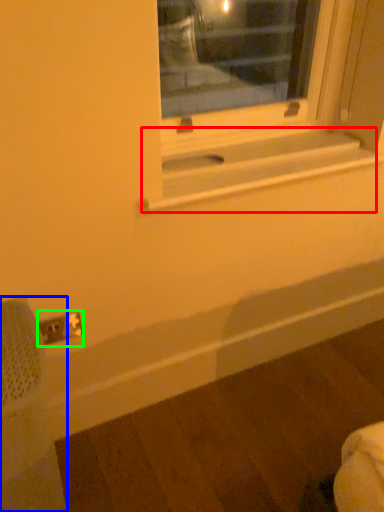
Question: Which is farther away from window sill (highlighted by a red box)? swivel chair (highlighted by a blue box) or electric outlet (highlighted by a green box)?

Choices:
 (A) swivel chair
 (B) electric outlet

Answer: (A)